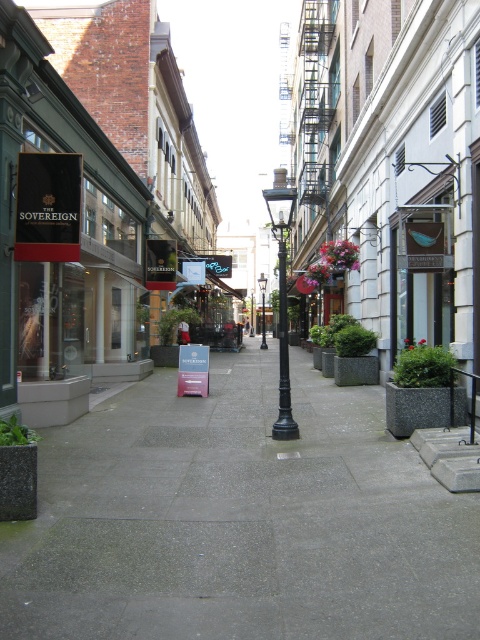
Can you confirm if metallic silver sign at center is positioned above black metal lamp post at center?

Yes.

The height and width of the screenshot is (640, 480). I want to click on metallic silver sign at center, so click(213, 262).

At what (x,y) coordinates should I click in order to perform the action: click on metallic silver sign at center. Please return your answer as a coordinate pair (x, y). The height and width of the screenshot is (640, 480). Looking at the image, I should click on (213, 262).

Can you confirm if black matte sign at upper left is smaller than metallic silver sign at center?

Yes, black matte sign at upper left is smaller than metallic silver sign at center.

In the scene shown: Who is shorter, black matte sign at upper left or metallic silver sign at center?

Standing shorter between the two is black matte sign at upper left.

Is point (61, 204) closer to camera compared to point (215, 275)?

Yes, it is in front of point (215, 275).

Locate an element on the screen. black matte sign at upper left is located at coordinates (48, 205).

Does black matte sign at upper left appear over black metal lamp post at center?

Yes, black matte sign at upper left is above black metal lamp post at center.

Who is positioned more to the right, black matte sign at upper left or black metal lamp post at center?

black metal lamp post at center

Describe the element at coordinates (48, 205) in the screenshot. I see `black matte sign at upper left` at that location.

You are a GUI agent. You are given a task and a screenshot of the screen. Output one action in this format:
    pyautogui.click(x=<x>, y=<y>)
    Task: Click on the black matte sign at upper left
    
    Given the screenshot: What is the action you would take?
    pyautogui.click(x=48, y=205)